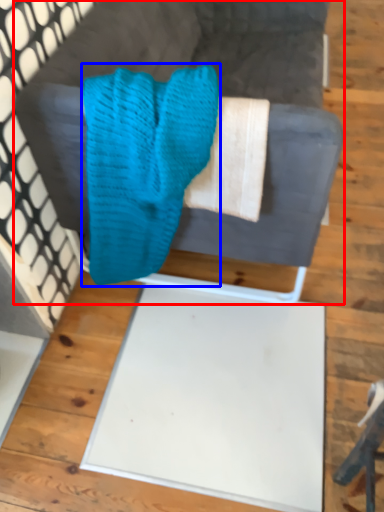
Question: Among these objects, which one is nearest to the camera, furniture (highlighted by a red box) or scrub (highlighted by a blue box)?

Choices:
 (A) furniture
 (B) scrub

Answer: (B)